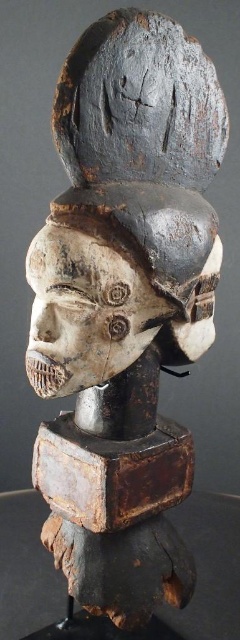
Question: Is white carved wood mask at center positioned before dark gray wood mask at upper center?

Choices:
 (A) yes
 (B) no

Answer: (B)

Question: Is white carved wood mask at center above dark gray wood mask at upper center?

Choices:
 (A) yes
 (B) no

Answer: (B)

Question: Is white carved wood mask at center wider than dark gray wood mask at upper center?

Choices:
 (A) no
 (B) yes

Answer: (B)

Question: Which point is closer to the camera taking this photo?

Choices:
 (A) (125, 296)
 (B) (81, 173)

Answer: (B)